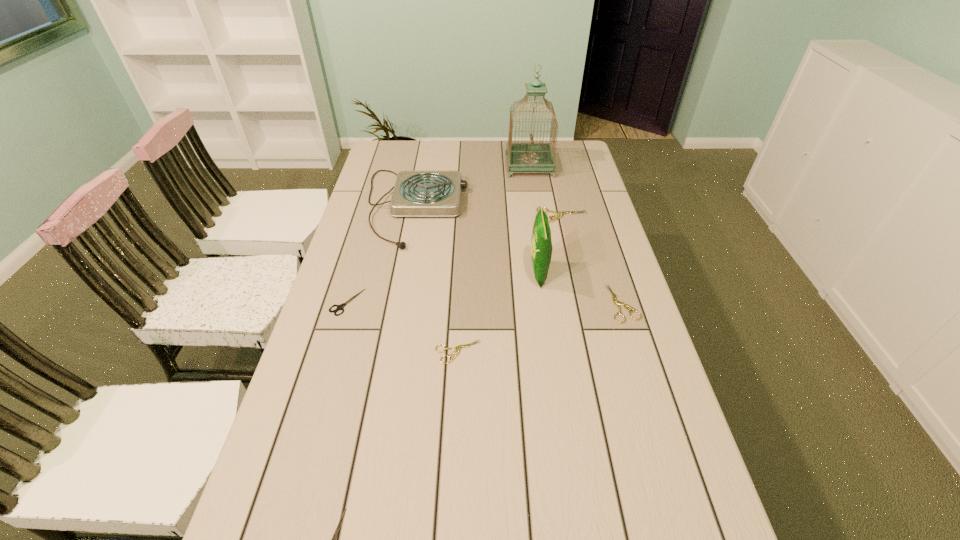
Point out which object is positioned as the sixth nearest to the tallest object. Please provide its 2D coordinates. Your answer should be formatted as a tuple, i.e. [(x, y)], where the tuple contains the x and y coordinates of a point satisfying the conditions above.

[(457, 348)]

I want to click on shears identified as the closest to the leftmost beige shears, so click(x=339, y=307).

At what (x,y) coordinates should I click in order to perform the action: click on the closest shears to the bigger black shears. Please return your answer as a coordinate pair (x, y). The width and height of the screenshot is (960, 540). Looking at the image, I should click on (457, 348).

Identify which beige shears is the third closest to the tallest object. Please provide its 2D coordinates. Your answer should be formatted as a tuple, i.e. [(x, y)], where the tuple contains the x and y coordinates of a point satisfying the conditions above.

[(457, 348)]

Where is `the second closest beige shears to the nearest shears`? the second closest beige shears to the nearest shears is located at coordinates (616, 302).

Locate an element on the screen. This screenshot has height=540, width=960. vacant space that satisfies the following two spatial constraints: 1. on the back side of the second nearest beige shears; 2. at the door of the tallest object is located at coordinates (580, 166).

The width and height of the screenshot is (960, 540). I want to click on free spot that satisfies the following two spatial constraints: 1. on the back side of the farthest beige shears; 2. with a retractable cable on the side of the hotplate, so click(561, 207).

Identify the location of vacant area that satisfies the following two spatial constraints: 1. on the front side of the second farthest beige shears; 2. on the left side of the leftmost shears. The width and height of the screenshot is (960, 540). (347, 303).

In order to click on free spot that satisfies the following two spatial constraints: 1. on the back side of the second farthest beige shears; 2. with a retractable cable on the side of the hotplate in this screenshot , I will do `click(592, 207)`.

This screenshot has width=960, height=540. I want to click on free spot that satisfies the following two spatial constraints: 1. on the back side of the farthest shears; 2. with a retractable cable on the side of the sixth shortest object, so click(x=561, y=207).